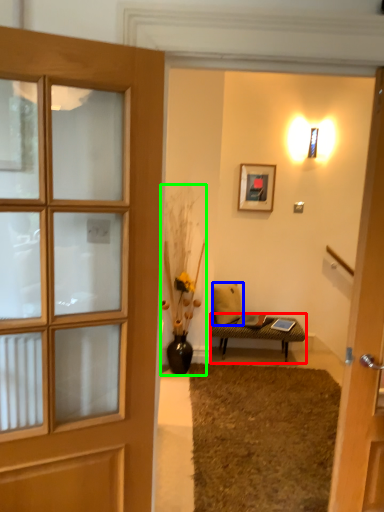
Question: Estimate the real-world distances between objects in this image. Which object is closer to table (highlighted by a red box), pillow (highlighted by a blue box) or houseplant (highlighted by a green box)?

Choices:
 (A) pillow
 (B) houseplant

Answer: (A)